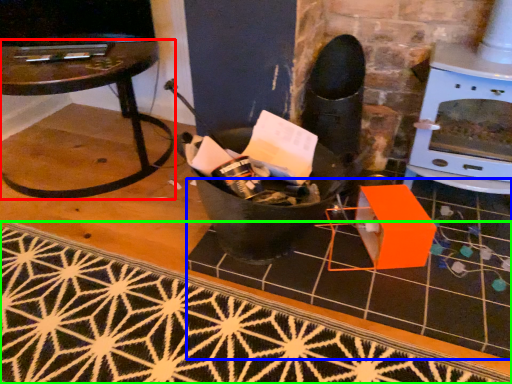
Question: Considering the real-world distances, which object is farthest from table (highlighted by a red box)? tile (highlighted by a blue box) or doormat (highlighted by a green box)?

Choices:
 (A) tile
 (B) doormat

Answer: (A)